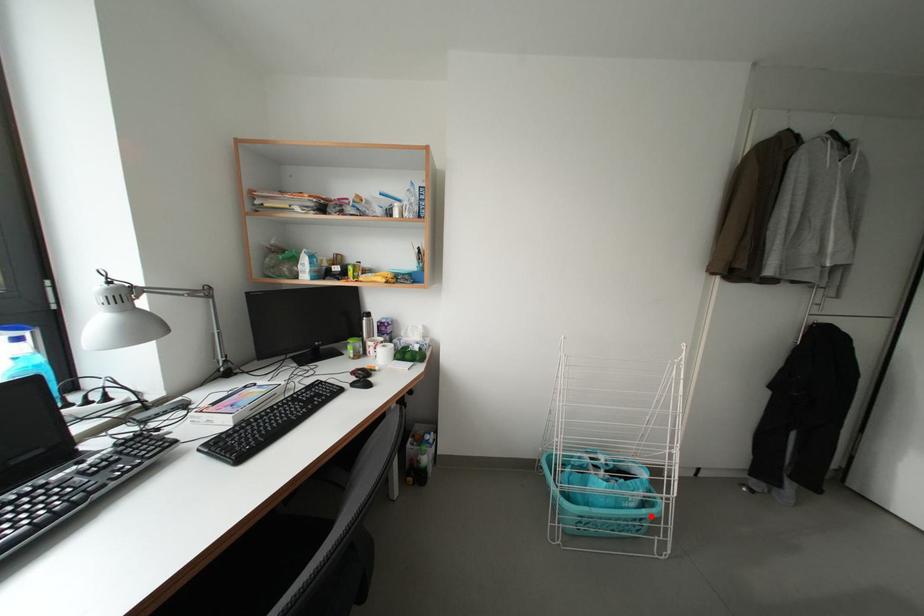
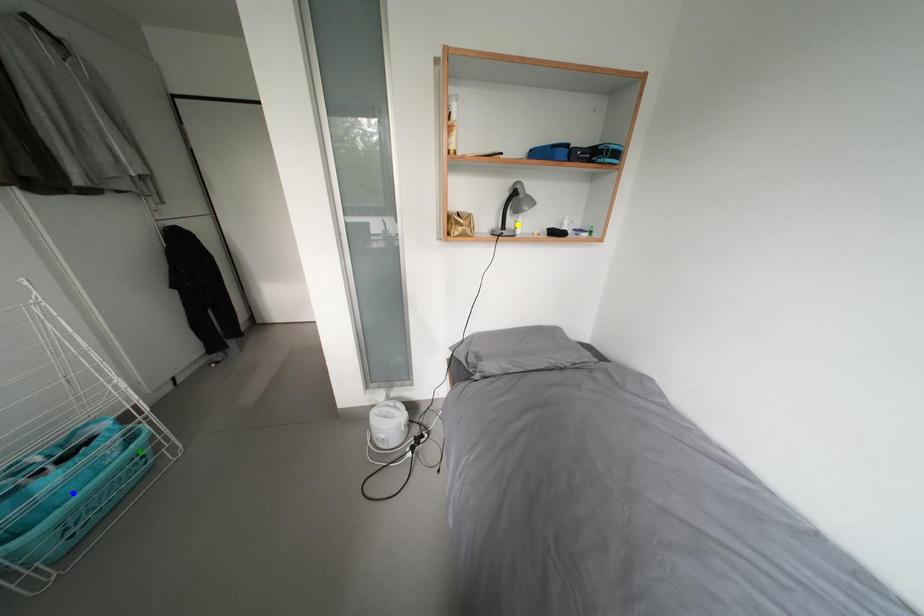
Question: I am providing you with two images of the same scene from different viewpoints. A red point is marked on the first image. You are given multiple points on the second image. Can you choose the point in image 2 that corresponds to the point in image 1?

Choices:
 (A) green point
 (B) blue point
 (C) yellow point

Answer: (A)